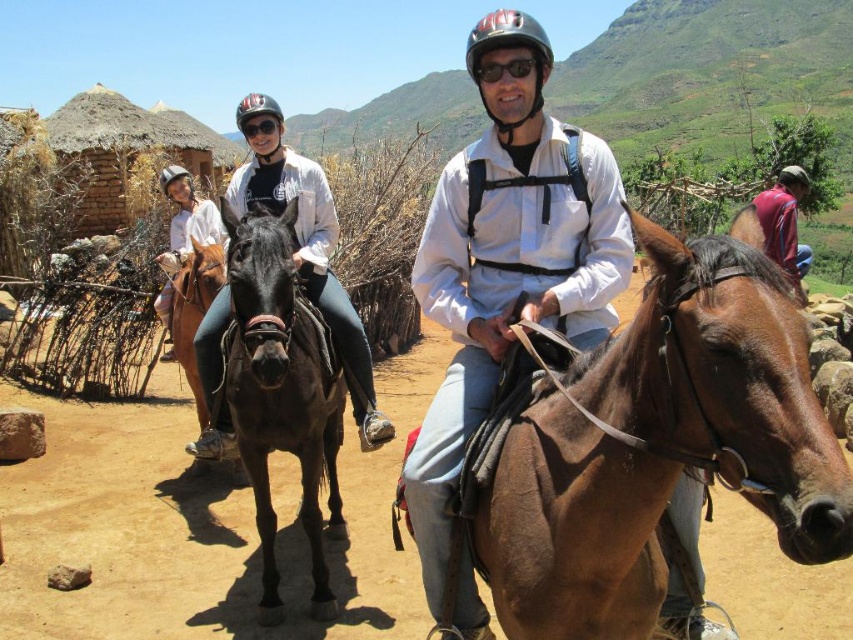
You are a photographer positioned at the origin point. The shiny black horse at center is at coordinates 0.609, 0.331. If you want to capture the horse in your shot, which direction should you move your camera?

The shiny black horse at center is located at point [281,388], so you should move your camera towards the right and slightly upwards to capture it.

You are a photographer trying to capture the shiny brown horse at center and the black matte goggles at upper center in the same frame. Since you want both subjects to be clearly visible, which one should you adjust your camera focus on first, the one closer to you or the one further away?

The shiny brown horse at center is to the left of black matte goggles at upper center, meaning the horse is closer to you. To ensure both are in focus, start focusing on the closer object, the shiny brown horse at center, then adjust for the black matte goggles at upper center.

You are a photographer standing at the camera position. You want to place a small flag at point (195, 259) which is 5.21 meters away from you. The flag is 0.5 meters tall. Will the flag be visible above the two riders on dark brown horse and lighter brown horse?

The flag placed at point (195, 259) will be 5.21 meters away from the photographer. Since the two riders are in the foreground and closer to the camera, the flag at that distance may not be visible above them unless it is elevated. However, the flag is only 0.5 meters tall, so it might be obscured by the riders who are closer and likely taller than 0.5 meters. Therefore, the flag might not be fully visible above the riders.